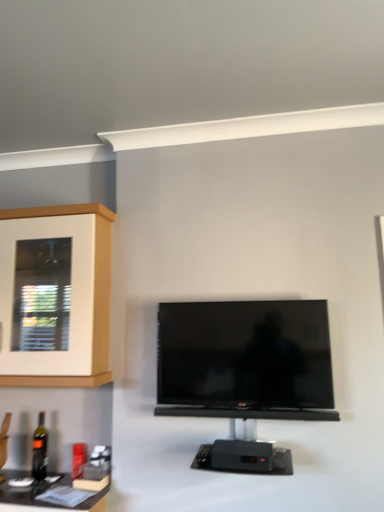
This screenshot has width=384, height=512. In order to click on wooden cabinet at left in this screenshot , I will do `click(94, 295)`.

This screenshot has width=384, height=512. I want to click on black glossy tv at center, so click(245, 360).

Is wooden cabinet at left not near black glass bottle at lower left?

No, wooden cabinet at left is not far away from black glass bottle at lower left.

Does point (100, 372) come behind point (32, 462)?

No, it is not.

Is wooden cabinet at left not within black glass bottle at lower left?

Yes, wooden cabinet at left is outside of black glass bottle at lower left.

From the image's perspective, is wooden cabinet at left positioned above or below black glass bottle at lower left?

Clearly, from the image's perspective, wooden cabinet at left is above black glass bottle at lower left.

Which object is closer to the camera, black glass bottle at lower left or black glossy tv at center?

black glossy tv at center is in front.

How different are the orientations of black glass bottle at lower left and black glossy tv at center in degrees?

They differ by 0.0653 degrees in their facing directions.

Considering the relative positions of black glass bottle at lower left and black glossy tv at center in the image provided, is black glass bottle at lower left to the right of black glossy tv at center from the viewer's perspective?

No.

Consider the image. Can we say wooden cabinet at left lies outside black glossy tv at center?

That's correct, wooden cabinet at left is outside of black glossy tv at center.

Considering the sizes of wooden cabinet at left and black glossy tv at center in the image, is wooden cabinet at left bigger or smaller than black glossy tv at center?

wooden cabinet at left is bigger than black glossy tv at center.

From the picture: Is wooden cabinet at left far away from black glossy tv at center?

No, wooden cabinet at left is not far away from black glossy tv at center.

Is black glossy tv at center inside the boundaries of wooden cabinet at left, or outside?

black glossy tv at center is outside wooden cabinet at left.

Are black glossy tv at center and wooden cabinet at left beside each other?

black glossy tv at center and wooden cabinet at left are clearly separated.

Based on their positions, is black glossy tv at center located to the left or right of wooden cabinet at left?

In the image, black glossy tv at center appears on the right side of wooden cabinet at left.

Is black glossy tv at center further to camera compared to wooden cabinet at left?

No, it is not.

This screenshot has height=512, width=384. Identify the location of bottle beneath the black glossy tv at center (from a real-world perspective). (40, 449).

From a real-world perspective, who is located lower, black glossy tv at center or black glass bottle at lower left?

In real-world perspective, black glass bottle at lower left is lower.

Does black glossy tv at center have a larger size compared to black glass bottle at lower left?

Yes.

Does black glossy tv at center have a greater width compared to black glass bottle at lower left?

Indeed, black glossy tv at center has a greater width compared to black glass bottle at lower left.

Is black glass bottle at lower left positioned with its back to wooden cabinet at left?

No, black glass bottle at lower left is not facing away from wooden cabinet at left.

Considering the points (32, 475) and (102, 211), which point is in front, point (32, 475) or point (102, 211)?

The point (32, 475) is closer.

This screenshot has height=512, width=384. I want to click on bottle below the wooden cabinet at left (from a real-world perspective), so click(40, 449).

Considering the relative sizes of black glass bottle at lower left and wooden cabinet at left in the image provided, is black glass bottle at lower left shorter than wooden cabinet at left?

Yes.

Image resolution: width=384 pixels, height=512 pixels. In order to click on cabinetry located on the right of black glass bottle at lower left in this screenshot , I will do `click(94, 295)`.

At what (x,y) coordinates should I click in order to perform the action: click on television that is above the black glass bottle at lower left (from the image's perspective). Please return your answer as a coordinate pair (x, y). The image size is (384, 512). Looking at the image, I should click on (245, 360).

Which object lies nearer to the anchor point black glass bottle at lower left, black glossy tv at center or wooden cabinet at left?

wooden cabinet at left lies closer to black glass bottle at lower left than the other object.

When comparing their distances from black glossy tv at center, does wooden cabinet at left or black glass bottle at lower left seem closer?

wooden cabinet at left is closer to black glossy tv at center.

Based on their spatial positions, is black glossy tv at center or black glass bottle at lower left closer to wooden cabinet at left?

black glossy tv at center lies closer to wooden cabinet at left than the other object.

Based on their spatial positions, is wooden cabinet at left or black glossy tv at center closer to black glass bottle at lower left?

wooden cabinet at left.

Based on their spatial positions, is black glass bottle at lower left or black glossy tv at center further from wooden cabinet at left?

Answer: black glass bottle at lower left.

From the image, which object appears to be nearer to black glossy tv at center, black glass bottle at lower left or wooden cabinet at left?

wooden cabinet at left is closer to black glossy tv at center.

Where is `cabinetry between black glass bottle at lower left and black glossy tv at center from left to right`? This screenshot has height=512, width=384. cabinetry between black glass bottle at lower left and black glossy tv at center from left to right is located at coordinates (94, 295).